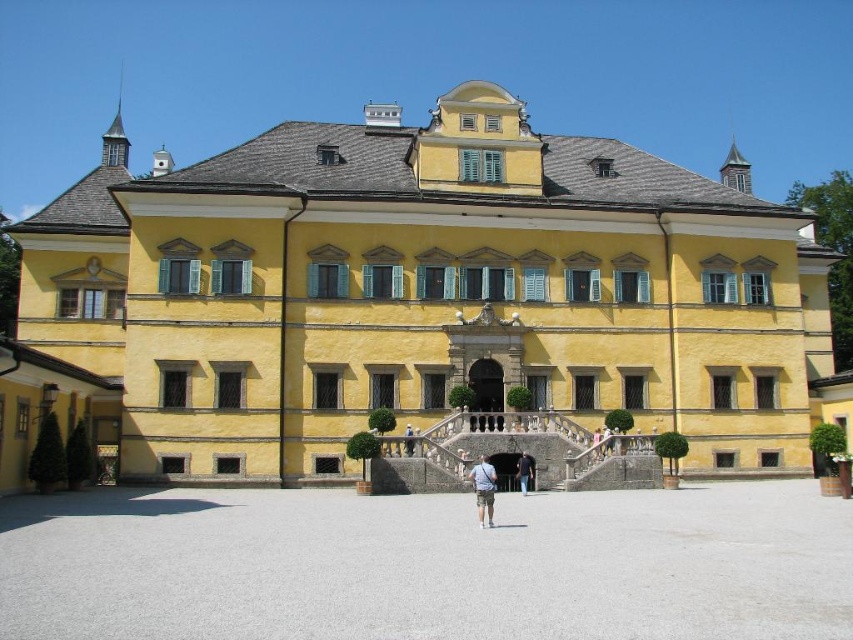
You are standing in front of the grand yellow building and see a brown leather bag at center and a brown leather backpack at center. Which item is closer to you?

The brown leather bag at center is closer to you because the brown leather backpack at center is behind it.

You are standing 200 feet away from the grand yellow building. You want to take a photo of the point at coordinates point (524, 467). Is the point within your camera frame if your camera can capture objects within 200 feet range?

The distance of point (524, 467) from viewer is 176.79 feet, which is within the camera range of 200 feet. Therefore, the point is within the camera frame.

You are standing in front of the grand yellow building and see a person wearing a dark blue shirt at center holding a brown leather bag at center. Which object is taller?

The dark blue shirt at center is much taller than the brown leather bag at center.